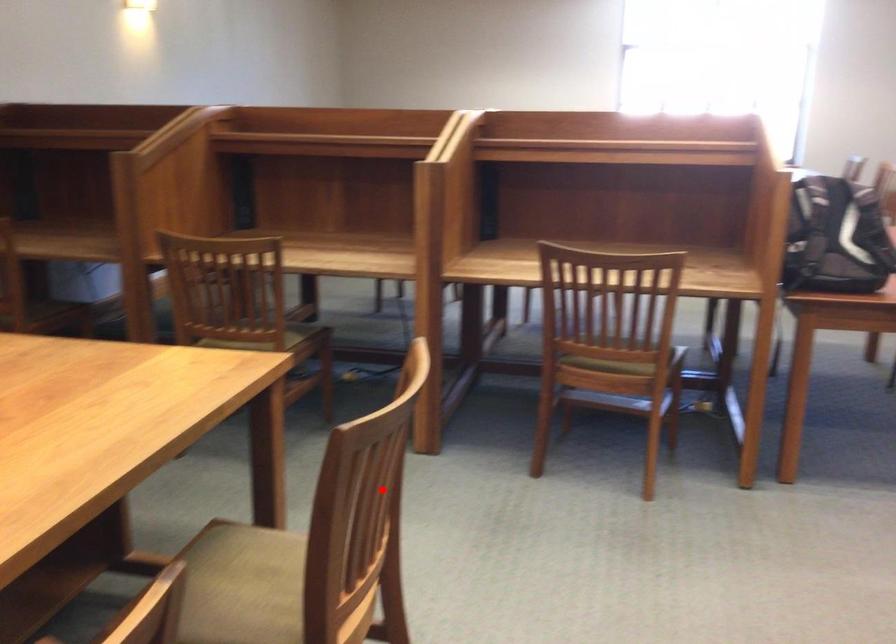
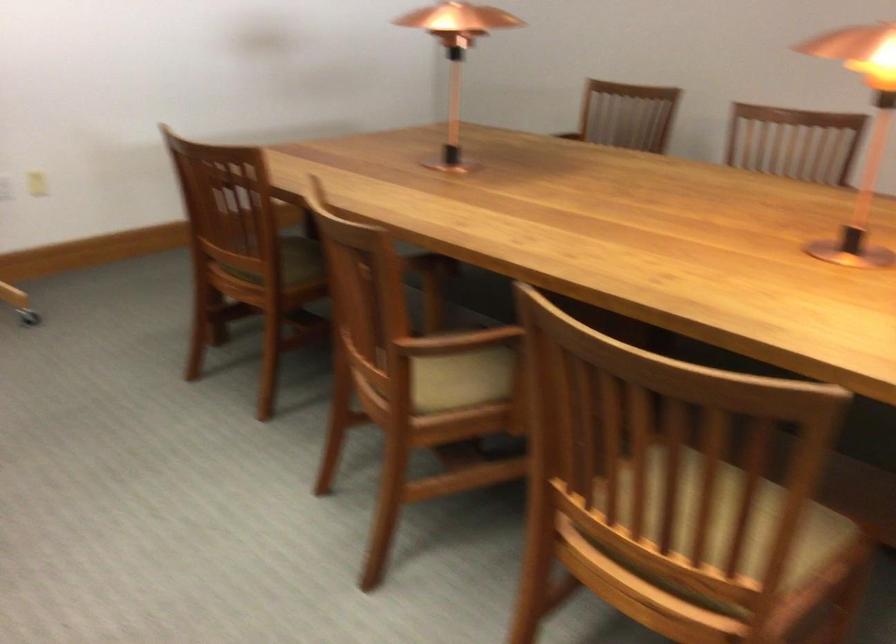
The point at the highlighted location is marked in the first image. Where is the corresponding point in the second image?

(728, 526)